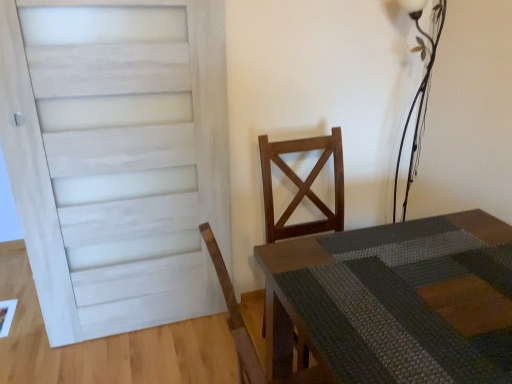
Question: Considering the relative sizes of rustic wood table at center and metallic wire at upper right in the image provided, is rustic wood table at center thinner than metallic wire at upper right?

Choices:
 (A) yes
 (B) no

Answer: (B)

Question: Is the depth of rustic wood table at center less than that of metallic wire at upper right?

Choices:
 (A) yes
 (B) no

Answer: (A)

Question: Can you confirm if rustic wood table at center is taller than metallic wire at upper right?

Choices:
 (A) no
 (B) yes

Answer: (A)

Question: Is rustic wood table at center at the left side of metallic wire at upper right?

Choices:
 (A) no
 (B) yes

Answer: (B)

Question: Would you say metallic wire at upper right is part of rustic wood table at center's contents?

Choices:
 (A) yes
 (B) no

Answer: (B)

Question: In terms of width, does white painted wood door at left look wider or thinner when compared to rustic wood table at center?

Choices:
 (A) wide
 (B) thin

Answer: (B)

Question: Based on their sizes in the image, would you say white painted wood door at left is bigger or smaller than rustic wood table at center?

Choices:
 (A) small
 (B) big

Answer: (A)

Question: Would you say white painted wood door at left is inside or outside rustic wood table at center?

Choices:
 (A) inside
 (B) outside

Answer: (B)

Question: In terms of height, does white painted wood door at left look taller or shorter compared to rustic wood table at center?

Choices:
 (A) tall
 (B) short

Answer: (A)

Question: Is point (415, 160) closer or farther from the camera than point (423, 235)?

Choices:
 (A) closer
 (B) farther

Answer: (B)

Question: From the image's perspective, relative to rustic wood table at center, is metallic wire at upper right above or below?

Choices:
 (A) below
 (B) above

Answer: (B)

Question: Which is correct: metallic wire at upper right is inside rustic wood table at center, or outside of it?

Choices:
 (A) outside
 (B) inside

Answer: (A)

Question: Relative to rustic wood table at center, is metallic wire at upper right in front or behind?

Choices:
 (A) front
 (B) behind

Answer: (B)

Question: From the image's perspective, is rustic wood table at center located above or below white painted wood door at left?

Choices:
 (A) below
 (B) above

Answer: (A)

Question: In terms of width, does rustic wood table at center look wider or thinner when compared to white painted wood door at left?

Choices:
 (A) wide
 (B) thin

Answer: (A)